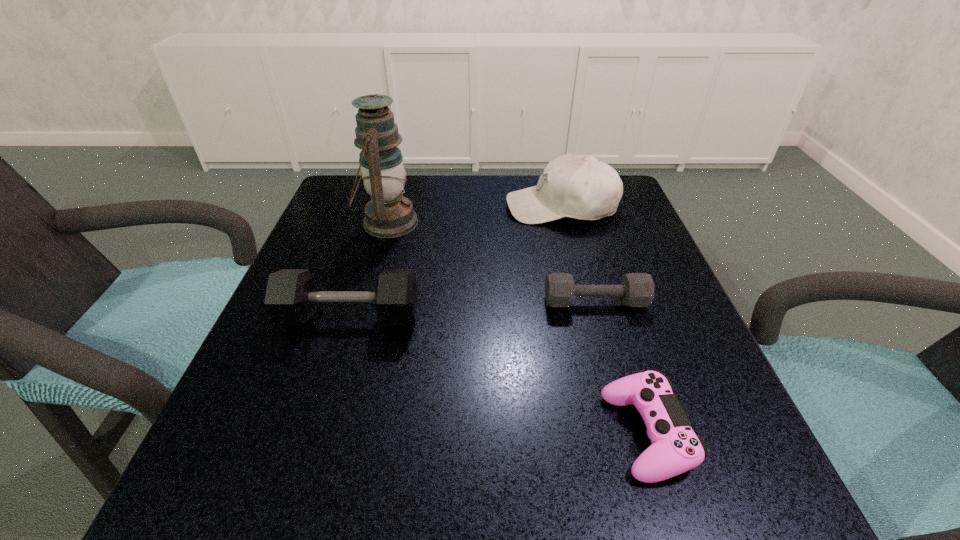
This screenshot has width=960, height=540. I want to click on free space located 0.390m on the right of the left dumbbell, so click(639, 318).

At what (x,y) coordinates should I click in order to perform the action: click on blank space located on the front of the right dumbbell. Please return your answer as a coordinate pair (x, y). This screenshot has width=960, height=540. Looking at the image, I should click on (611, 359).

Image resolution: width=960 pixels, height=540 pixels. Find the location of `free space located on the back of the control`. free space located on the back of the control is located at coordinates (617, 339).

Identify the location of oil lamp that is at the far edge. The width and height of the screenshot is (960, 540). (389, 214).

Identify the location of baseball cap that is at the far edge. The height and width of the screenshot is (540, 960). (581, 187).

Locate an element on the screen. The image size is (960, 540). object that is at the near edge is located at coordinates (675, 449).

What are the coordinates of `oil lamp that is at the left edge` in the screenshot? It's located at (389, 214).

Locate an element on the screen. This screenshot has width=960, height=540. dumbbell located in the left edge section of the desktop is located at coordinates (290, 298).

Where is `baseball cap located in the right edge section of the desktop`? baseball cap located in the right edge section of the desktop is located at coordinates (581, 187).

Identify the location of dumbbell positioned at the right edge. (636, 289).